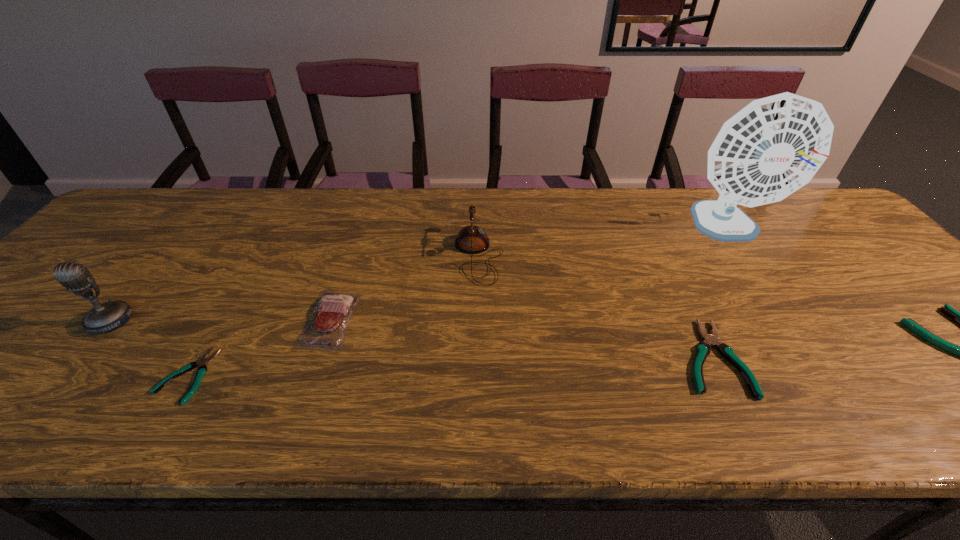
You are a GUI agent. You are given a task and a screenshot of the screen. Output one action in this format:
    pyautogui.click(x=<x>, y=<y>)
    Task: Click on the free space between the microphone and the shortest pliers
    The image size is (960, 540).
    Given the screenshot: What is the action you would take?
    pyautogui.click(x=149, y=348)

This screenshot has height=540, width=960. Find the location of `free point between the fourth object from left to right and the sixth shortest object`. free point between the fourth object from left to right and the sixth shortest object is located at coordinates (295, 288).

Find the location of a particular element. object that can be found as the sixth closest to the second tallest object is located at coordinates (959, 317).

This screenshot has height=540, width=960. I want to click on object that ranks as the third closest to the fourth object from right to left, so click(771, 148).

Identify which pliers is located as the nearest to the fourth tallest object. Please provide its 2D coordinates. Your answer should be formatted as a tuple, i.e. [(x, y)], where the tuple contains the x and y coordinates of a point satisfying the conditions above.

[(203, 361)]

Find the location of a particular element. The image size is (960, 540). pliers that can be found as the third closest to the fourth object from right to left is located at coordinates (959, 317).

At what (x,y) coordinates should I click in order to perform the action: click on free point that satisfies the following two spatial constraints: 1. on the rotary dial of the second pliers from left to right; 2. on the right side of the fifth shortest object. Please return your answer as a coordinate pair (x, y). This screenshot has height=540, width=960. Looking at the image, I should click on (478, 357).

At what (x,y) coordinates should I click in order to perform the action: click on vacant space that satisfies the following two spatial constraints: 1. on the back side of the second pliers from left to right; 2. on the rotary dial of the telephone. Please return your answer as a coordinate pair (x, y). Looking at the image, I should click on (663, 256).

Locate an element on the screen. The image size is (960, 540). free point that satisfies the following two spatial constraints: 1. on the grille of the second object from right to left; 2. on the rotary dial of the third tallest object is located at coordinates 746,256.